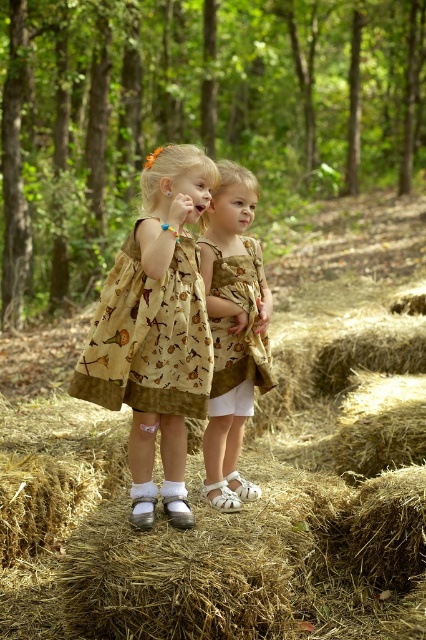
Who is higher up, golden straw bale at center or matte brown dress at center?

matte brown dress at center

Is golden straw bale at center taller than matte brown dress at center?

Incorrect, golden straw bale at center's height is not larger of matte brown dress at center's.

Does point (118, 484) come in front of point (222, 296)?

No, (118, 484) is further to viewer.

Find the location of a particular element. The width and height of the screenshot is (426, 640). golden straw bale at center is located at coordinates (244, 504).

Who is shorter, golden straw bale at center or printed cotton dress at center?

With less height is golden straw bale at center.

Can you confirm if golden straw bale at center is shorter than printed cotton dress at center?

Indeed, golden straw bale at center has a lesser height compared to printed cotton dress at center.

At what (x,y) coordinates should I click in order to perform the action: click on golden straw bale at center. Please return your answer as a coordinate pair (x, y). Looking at the image, I should click on (244, 504).

Which is behind, point (78, 388) or point (207, 241)?

Positioned behind is point (207, 241).

Is yellow cotton dress at center wider than printed cotton dress at center?

Correct, the width of yellow cotton dress at center exceeds that of printed cotton dress at center.

Find the location of a particular element. The width and height of the screenshot is (426, 640). yellow cotton dress at center is located at coordinates (149, 337).

The width and height of the screenshot is (426, 640). Identify the location of yellow cotton dress at center. (149, 337).